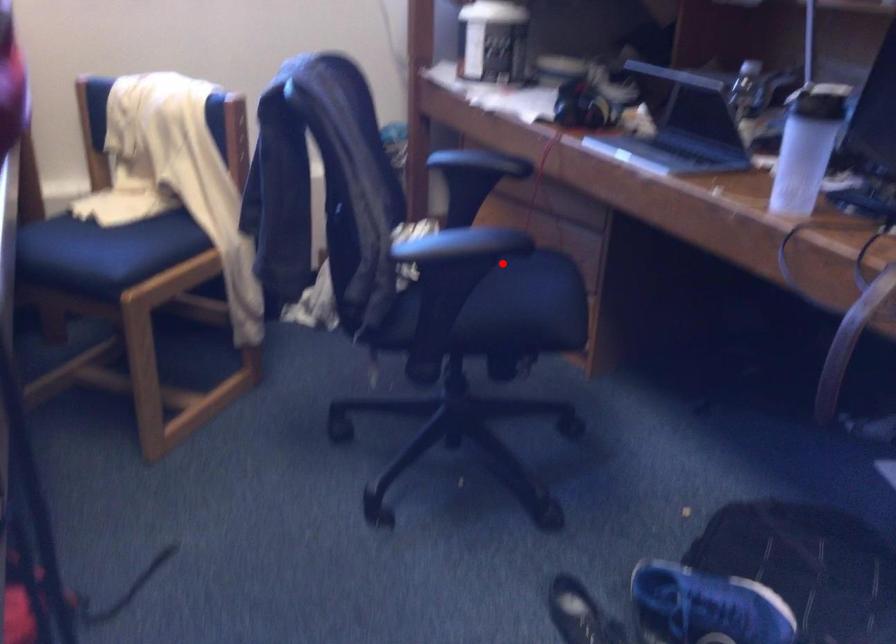
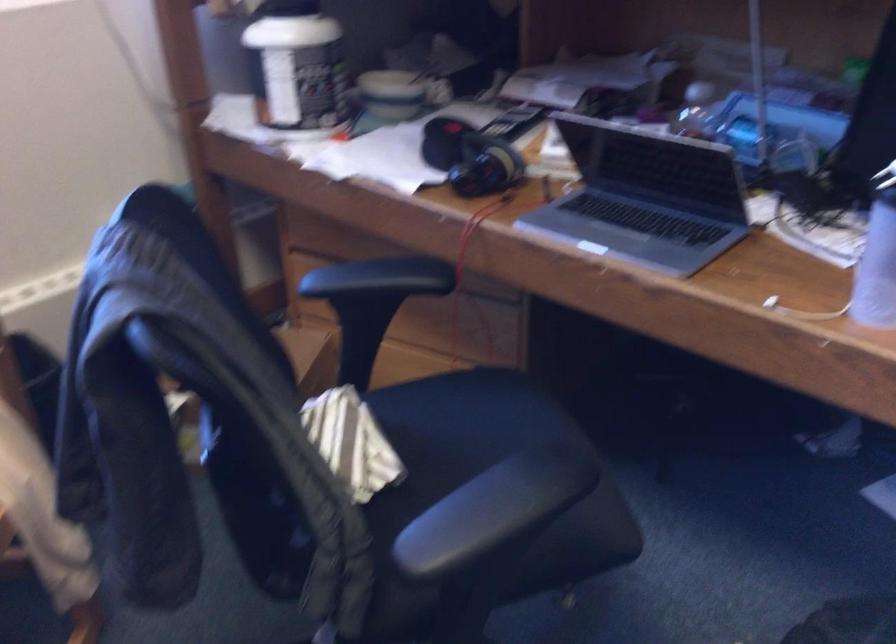
The point at the highlighted location is marked in the first image. Where is the corresponding point in the second image?

(461, 424)